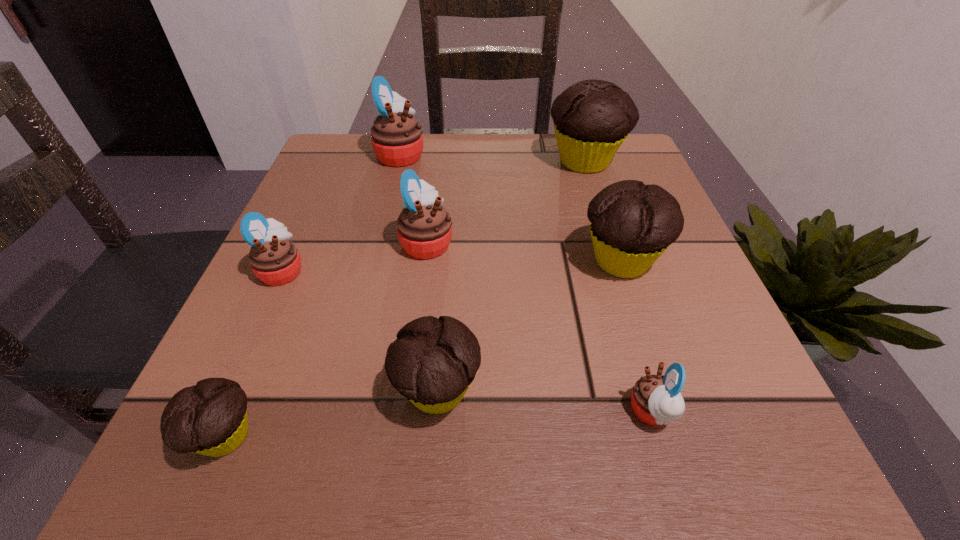
This screenshot has width=960, height=540. What are the coordinates of `free space in the image that satisfies the following two spatial constraints: 1. on the front-facing side of the second biggest pink muffin; 2. on the left side of the second chocolate muffin from left to right` in the screenshot? It's located at (407, 391).

The width and height of the screenshot is (960, 540). Identify the location of free space that satisfies the following two spatial constraints: 1. on the back side of the third biggest chocolate muffin; 2. on the front-facing side of the second biggest pink muffin. (449, 242).

The height and width of the screenshot is (540, 960). I want to click on vacant space that satisfies the following two spatial constraints: 1. on the front side of the biggest chocolate muffin; 2. on the front-facing side of the leftmost pink muffin, so click(x=620, y=270).